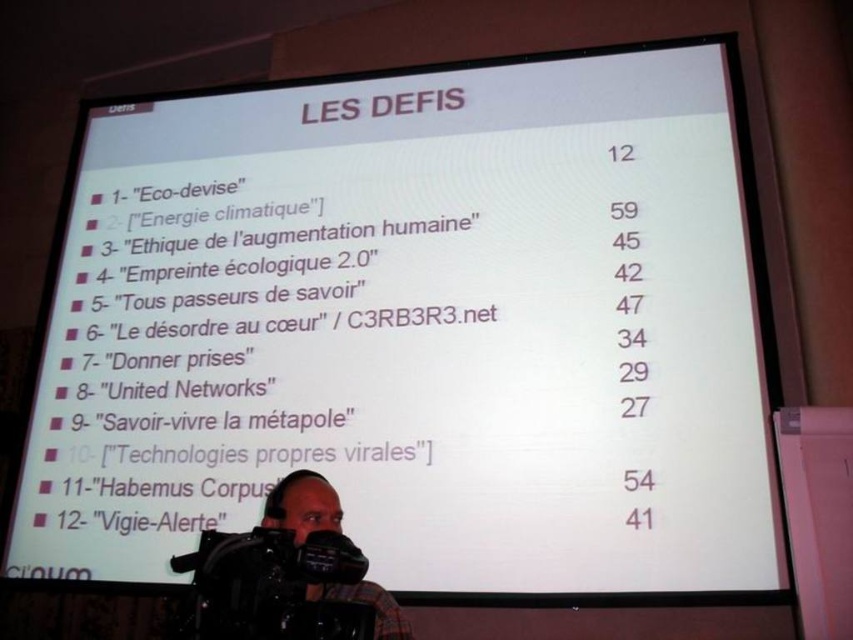
Does point (366, 564) come closer to viewer compared to point (305, 529)?

Yes, point (366, 564) is in front of point (305, 529).

Consider the image. Does black plastic camera at lower left have a lesser width compared to plaid fabric camera at lower center?

Correct, black plastic camera at lower left's width is less than plaid fabric camera at lower center's.

Describe the element at coordinates (271, 586) in the screenshot. This screenshot has width=853, height=640. I see `black plastic camera at lower left` at that location.

You are a GUI agent. You are given a task and a screenshot of the screen. Output one action in this format:
    pyautogui.click(x=<x>, y=<y>)
    Task: Click on the black plastic camera at lower left
    
    Given the screenshot: What is the action you would take?
    pyautogui.click(x=271, y=586)